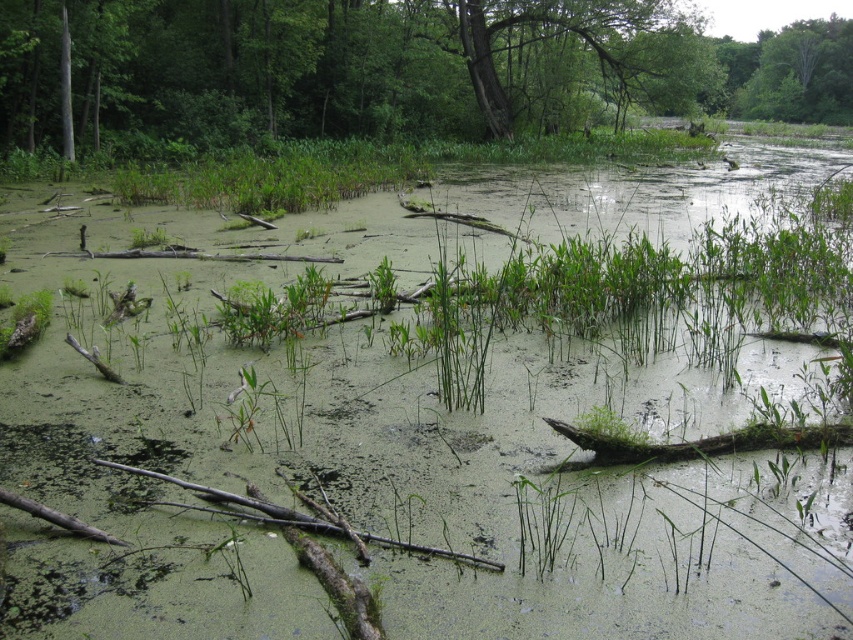
Question: Which of the following is the closest to the observer?

Choices:
 (A) (491, 29)
 (B) (428, 72)

Answer: (B)

Question: Among these objects, which one is nearest to the camera?

Choices:
 (A) green rough bark tree at upper center
 (B) smooth bark tree at center

Answer: (B)

Question: Among these objects, which one is nearest to the camera?

Choices:
 (A) smooth bark tree at center
 (B) green rough bark tree at upper center

Answer: (A)

Question: Does smooth bark tree at center come in front of green rough bark tree at upper center?

Choices:
 (A) no
 (B) yes

Answer: (B)

Question: Is smooth bark tree at center wider than green rough bark tree at upper center?

Choices:
 (A) yes
 (B) no

Answer: (A)

Question: Observing the image, what is the correct spatial positioning of smooth bark tree at center in reference to green rough bark tree at upper center?

Choices:
 (A) right
 (B) left

Answer: (A)